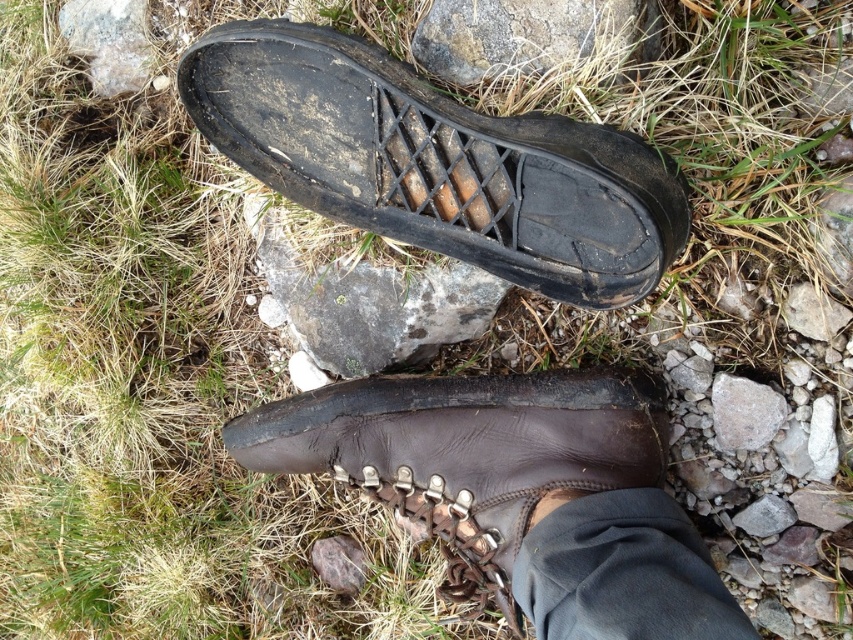
Between gray/mottled rock at center and gray rock at upper center, which one is positioned lower?

Positioned lower is gray/mottled rock at center.

You are a GUI agent. You are given a task and a screenshot of the screen. Output one action in this format:
    pyautogui.click(x=<x>, y=<y>)
    Task: Click on the gray/mottled rock at center
    
    Given the screenshot: What is the action you would take?
    pyautogui.click(x=369, y=304)

Locate an element on the screen. The image size is (853, 640). gray/mottled rock at center is located at coordinates (369, 304).

Locate an element on the screen. This screenshot has height=640, width=853. gray/mottled rock at center is located at coordinates (369, 304).

Is point (512, 452) positioned after point (767, 428)?

That is True.

Who is more distant from viewer, (426, 508) or (738, 397)?

Positioned behind is point (426, 508).

Identify the location of brown leather boot at center. The width and height of the screenshot is (853, 640). click(x=467, y=452).

Who is lower down, brown leather boot at center or gray/mottled rock at center?

brown leather boot at center

Who is taller, brown leather boot at center or gray/mottled rock at center?

brown leather boot at center is taller.

Which is in front, point (573, 476) or point (314, 282)?

Point (573, 476)

Image resolution: width=853 pixels, height=640 pixels. What are the coordinates of `brown leather boot at center` in the screenshot? It's located at (467, 452).